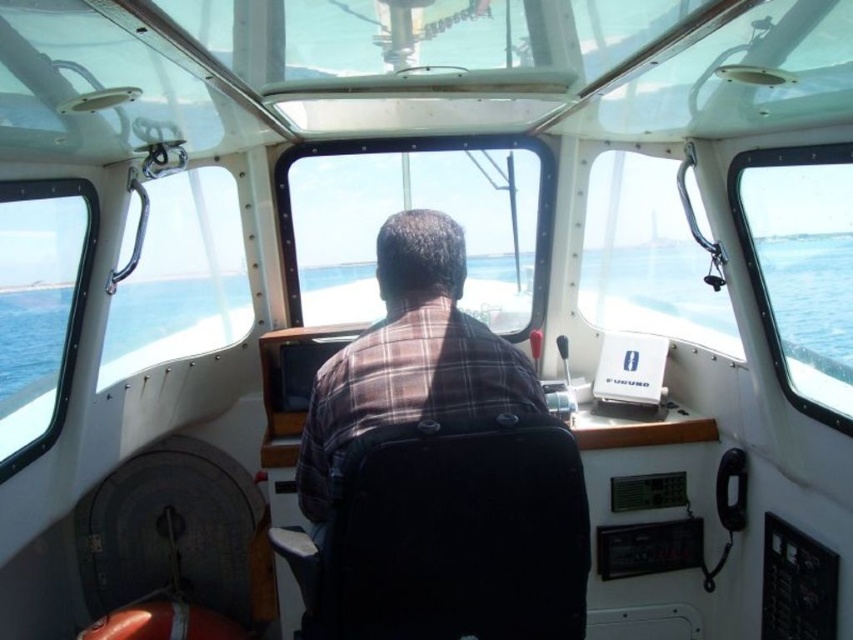
Question: Can you confirm if black fabric chair at center is bigger than transparent glass window at right?

Choices:
 (A) yes
 (B) no

Answer: (B)

Question: Does transparent glass window at center appear on the right side of transparent glass window at left?

Choices:
 (A) no
 (B) yes

Answer: (B)

Question: Which object is farther from the camera taking this photo?

Choices:
 (A) brown plaid shirt at center
 (B) black fabric chair at center
 (C) blue water at center
 (D) transparent glass window at center

Answer: (D)

Question: Is black fabric chair at center to the right of transparent glass window at right from the viewer's perspective?

Choices:
 (A) yes
 (B) no

Answer: (B)

Question: Among these points, which one is farthest from the camera?

Choices:
 (A) (347, 616)
 (B) (407, 188)
 (C) (811, 234)
 (D) (22, 180)

Answer: (B)

Question: Which object is positioned closest to the transparent glass window at left?

Choices:
 (A) transparent glass window at center
 (B) blue water at center

Answer: (A)